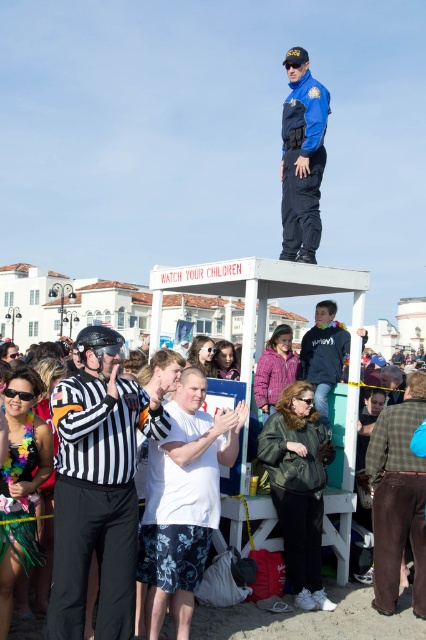
You are a photographer trying to capture a clear photo of the green plaid shirt at lower right and the white cotton crowd at center. Which subject should you focus on first to ensure it appears larger in your photo?

The green plaid shirt at lower right is much taller than the white cotton crowd at center, so you should focus on the green plaid shirt at lower right first to capture it as the larger subject.

You are a photographer at the beach who wants to take a picture of the green plaid shirt at lower right. Where should you position your camera to capture it?

The green plaid shirt at lower right is located at point (397, 497), so position your camera to aim at that coordinate to capture it.